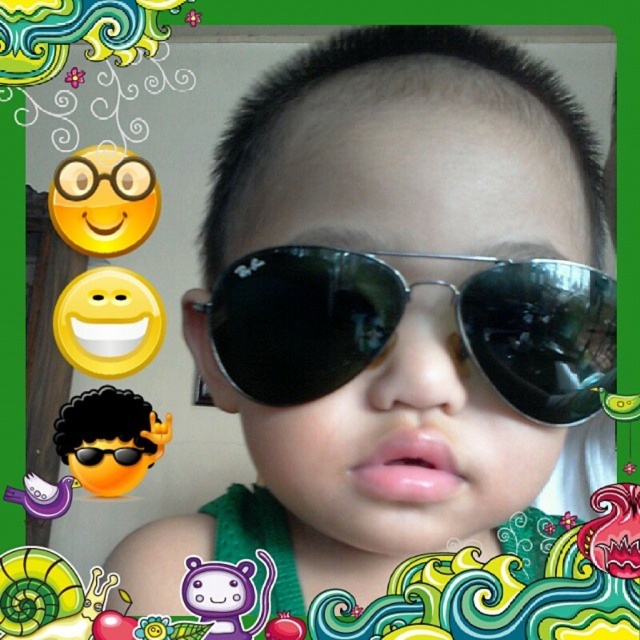
Who is shorter, matte black sunglasses at center or black reflective sunglasses at center?

Standing shorter between the two is black reflective sunglasses at center.

Which is in front, point (468, 212) or point (525, 296)?

Point (468, 212)

Is point (260, 227) closer to camera compared to point (586, 332)?

No, (260, 227) is behind (586, 332).

Find the location of a particular element. matte black sunglasses at center is located at coordinates (404, 440).